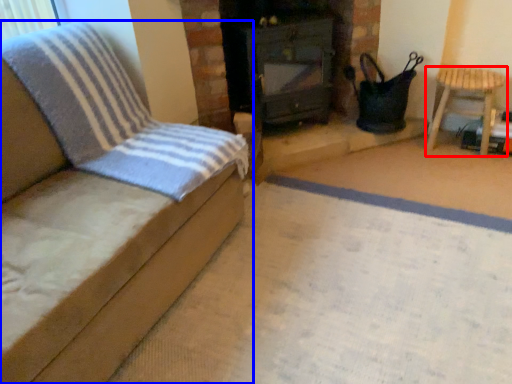
Question: Which of the following is the farthest to the observer, furniture (highlighted by a red box) or furniture (highlighted by a blue box)?

Choices:
 (A) furniture
 (B) furniture

Answer: (A)